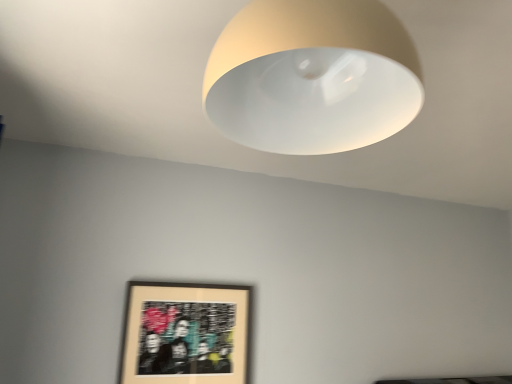
What do you see at coordinates (185, 333) in the screenshot?
I see `matte black picture frame at lower left` at bounding box center [185, 333].

You are a GUI agent. You are given a task and a screenshot of the screen. Output one action in this format:
    pyautogui.click(x=<x>, y=<y>)
    Task: Click on the matte black picture frame at lower left
    The height and width of the screenshot is (384, 512).
    Given the screenshot: What is the action you would take?
    pos(185,333)

I want to click on matte white lampshade at upper center, so click(312, 76).

Image resolution: width=512 pixels, height=384 pixels. What do you see at coordinates (312, 76) in the screenshot? I see `matte white lampshade at upper center` at bounding box center [312, 76].

Locate an element on the screen. This screenshot has width=512, height=384. matte black picture frame at lower left is located at coordinates (185, 333).

Is matte black picture frame at lower left at the right side of matte white lampshade at upper center?

No, matte black picture frame at lower left is not to the right of matte white lampshade at upper center.

Does matte black picture frame at lower left come behind matte white lampshade at upper center?

Yes, matte black picture frame at lower left is further from the viewer.

Which is behind, point (227, 323) or point (304, 94)?

Point (227, 323)

From the image's perspective, is matte black picture frame at lower left beneath matte white lampshade at upper center?

Correct, matte black picture frame at lower left appears lower than matte white lampshade at upper center in the image.

From a real-world perspective, is matte black picture frame at lower left over matte white lampshade at upper center?

No, from a real-world perspective, matte black picture frame at lower left is not on top of matte white lampshade at upper center.

Does matte black picture frame at lower left have a greater width compared to matte white lampshade at upper center?

In fact, matte black picture frame at lower left might be narrower than matte white lampshade at upper center.

Considering the relative sizes of matte black picture frame at lower left and matte white lampshade at upper center in the image provided, is matte black picture frame at lower left shorter than matte white lampshade at upper center?

No.

Which of these two, matte black picture frame at lower left or matte white lampshade at upper center, is bigger?

With larger size is matte white lampshade at upper center.

Is matte black picture frame at lower left surrounding matte white lampshade at upper center?

Definitely not — matte white lampshade at upper center is not inside matte black picture frame at lower left.

Are matte black picture frame at lower left and matte white lampshade at upper center far apart?

Indeed, matte black picture frame at lower left is not near matte white lampshade at upper center.

Is matte black picture frame at lower left oriented away from matte white lampshade at upper center?

No, matte black picture frame at lower left is not facing the opposite direction of matte white lampshade at upper center.

What's the angular difference between matte black picture frame at lower left and matte white lampshade at upper center's facing directions?

90.7 degrees.

Identify the location of picture frame behind the matte white lampshade at upper center. pyautogui.click(x=185, y=333).

Between matte white lampshade at upper center and matte black picture frame at lower left, which one appears on the left side from the viewer's perspective?

Positioned to the left is matte black picture frame at lower left.

Considering the positions of objects matte white lampshade at upper center and matte black picture frame at lower left in the image provided, who is behind, matte white lampshade at upper center or matte black picture frame at lower left?

matte black picture frame at lower left is behind.

Considering the points (246, 49) and (155, 347), which point is behind, point (246, 49) or point (155, 347)?

Positioned behind is point (155, 347).

From the image's perspective, which one is positioned lower, matte white lampshade at upper center or matte black picture frame at lower left?

matte black picture frame at lower left appears lower in the image.

From a real-world perspective, is matte white lampshade at upper center below matte black picture frame at lower left?

No, from a real-world perspective, matte white lampshade at upper center is not below matte black picture frame at lower left.

Can you confirm if matte white lampshade at upper center is thinner than matte black picture frame at lower left?

Incorrect, the width of matte white lampshade at upper center is not less than that of matte black picture frame at lower left.

Does matte white lampshade at upper center have a lesser height compared to matte black picture frame at lower left?

Yes, matte white lampshade at upper center is shorter than matte black picture frame at lower left.

Between matte white lampshade at upper center and matte black picture frame at lower left, which one has larger size?

matte white lampshade at upper center is bigger.

Can we say matte white lampshade at upper center lies outside matte black picture frame at lower left?

Yes, matte white lampshade at upper center is outside of matte black picture frame at lower left.

Can you see matte white lampshade at upper center touching matte black picture frame at lower left?

No.

Is matte white lampshade at upper center turned away from matte black picture frame at lower left?

No, matte white lampshade at upper center is not facing the opposite direction of matte black picture frame at lower left.

At what (x,y) coordinates should I click in order to perform the action: click on picture frame directly beneath the matte white lampshade at upper center (from a real-world perspective). Please return your answer as a coordinate pair (x, y). This screenshot has width=512, height=384. Looking at the image, I should click on (185, 333).

This screenshot has height=384, width=512. Identify the location of picture frame located on the left of matte white lampshade at upper center. (185, 333).

Identify the location of lamp that appears on the right of matte black picture frame at lower left. This screenshot has height=384, width=512. (312, 76).